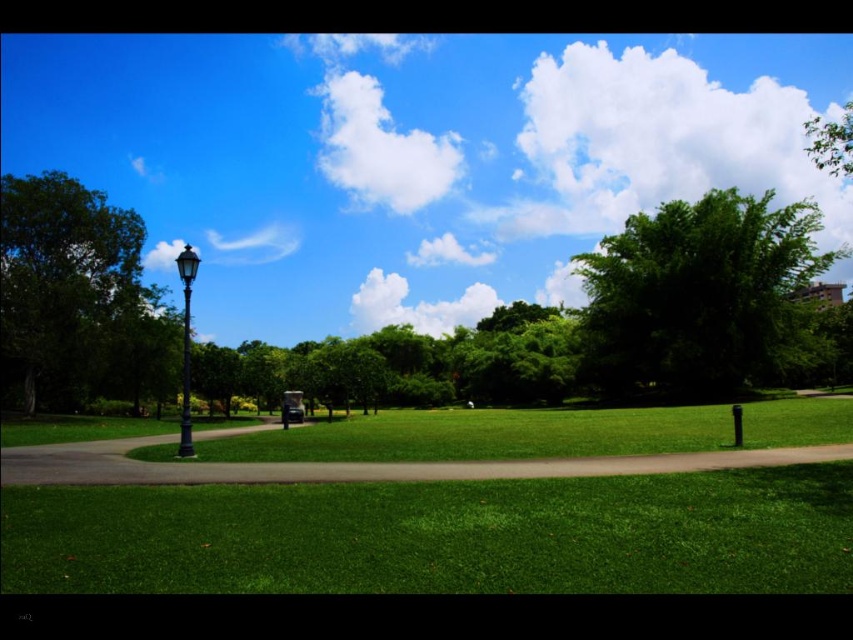
Question: Observing the image, what is the correct spatial positioning of blue sky at upper center in reference to green leafy tree at center?

Choices:
 (A) below
 (B) above

Answer: (B)

Question: Does green smooth grass at lower center have a greater width compared to polished blue glass lamp post at left?

Choices:
 (A) yes
 (B) no

Answer: (B)

Question: Estimate the real-world distances between objects in this image. Which object is closer to the green leafy tree at upper right?

Choices:
 (A) blue sky at upper center
 (B) green leafy tree at center
 (C) polished blue glass lamp post at left

Answer: (B)

Question: Is green smooth grass at lower center thinner than green leafy tree at right?

Choices:
 (A) yes
 (B) no

Answer: (A)

Question: Which object is the farthest from the green smooth grass at lower center?

Choices:
 (A) polished blue glass lamp post at left
 (B) green leafy tree at upper right

Answer: (B)

Question: Which object is farther from the camera taking this photo?

Choices:
 (A) green asphalt path at center
 (B) green smooth grass at lower center
 (C) green leafy tree at upper right

Answer: (C)